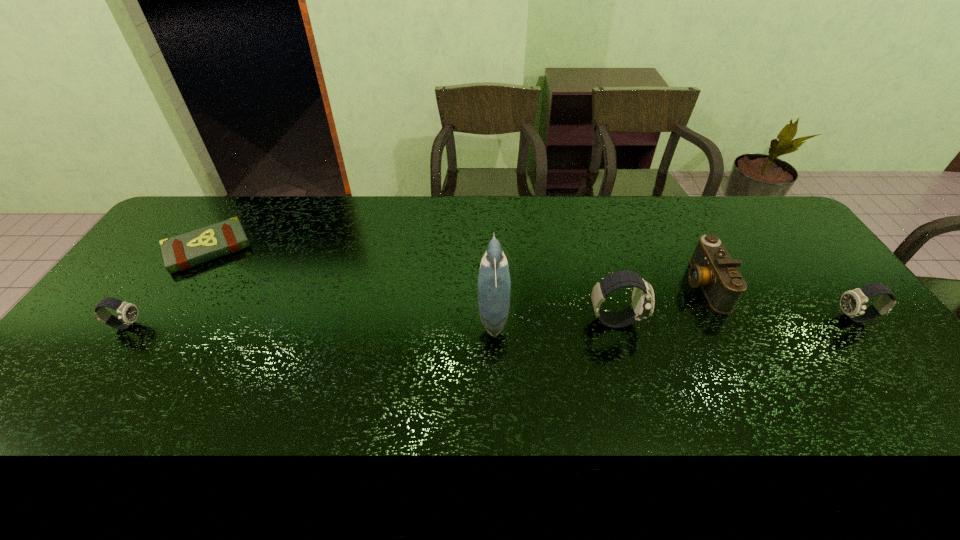
The height and width of the screenshot is (540, 960). I want to click on free space between the third object from right to left and the shortest object, so click(x=411, y=285).

Where is `free space between the shortest object and the second tallest object`? This screenshot has width=960, height=540. free space between the shortest object and the second tallest object is located at coordinates (411, 285).

Locate which object ranks third in proximity to the fifth object from left to right. Please provide its 2D coordinates. Your answer should be formatted as a tuple, i.e. [(x, y)], where the tuple contains the x and y coordinates of a point satisfying the conditions above.

[(494, 284)]

Locate which object is the fourth closest to the bird. Please provide its 2D coordinates. Your answer should be formatted as a tuple, i.e. [(x, y)], where the tuple contains the x and y coordinates of a point satisfying the conditions above.

[(853, 302)]

Identify the location of watch that is the second closest to the tallest watch. The image size is (960, 540). (127, 312).

Where is `watch that is the second closest to the leftmost watch`? This screenshot has height=540, width=960. watch that is the second closest to the leftmost watch is located at coordinates (853, 302).